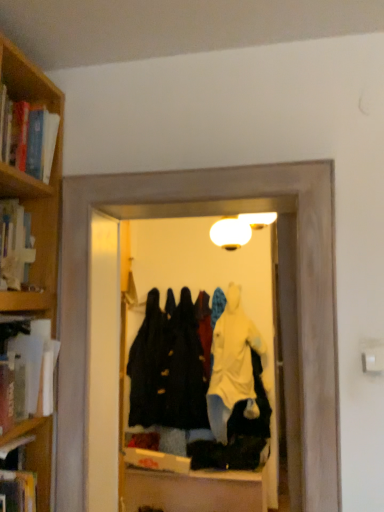
Question: Does point (23, 445) appear closer or farther from the camera than point (155, 355)?

Choices:
 (A) farther
 (B) closer

Answer: (B)

Question: From the image's perspective, relative to black matte coat at center, is hardcover book at left, the first book ordered from the bottom, above or below?

Choices:
 (A) below
 (B) above

Answer: (B)

Question: Which object is positioned farthest from the hardcover book at left, marked as the second book in a bottom-to-top arrangement?

Choices:
 (A) black matte coat at center
 (B) transparent plastic coat rack at center
 (C) hardcover book at left, which ranks as the second book in top-to-bottom order
 (D) hardcover book at left, the first book ordered from the bottom
 (E) light yellow cotton bathrobe at center

Answer: (B)

Question: Which is nearer to the hardcover book at left, acting as the 4th book starting from the top?

Choices:
 (A) hardcover book at left, marked as the second book in a bottom-to-top arrangement
 (B) wooden bookshelf at upper left, which is the fourth book from bottom to top
 (C) light yellow cotton bathrobe at center
 (D) transparent plastic coat rack at center
 (E) hardcover book at left, arranged as the third book when ordered from the bottom

Answer: (A)